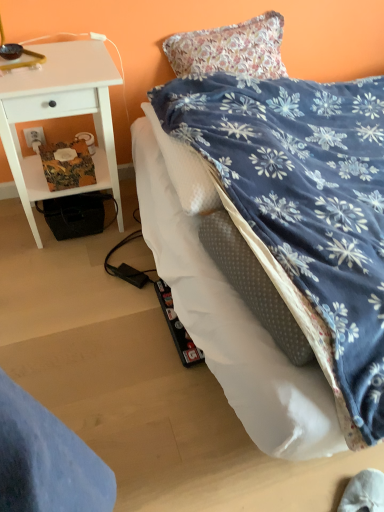
Question: Is white wood desk at left far away from white plastic power outlet at lower left?

Choices:
 (A) no
 (B) yes

Answer: (A)

Question: From a real-world perspective, does white wood desk at left stand above white plastic power outlet at lower left?

Choices:
 (A) no
 (B) yes

Answer: (B)

Question: Does white wood desk at left turn towards white plastic power outlet at lower left?

Choices:
 (A) yes
 (B) no

Answer: (B)

Question: From a real-world perspective, is white wood desk at left located beneath white plastic power outlet at lower left?

Choices:
 (A) yes
 (B) no

Answer: (B)

Question: Is white wood desk at left smaller than white plastic power outlet at lower left?

Choices:
 (A) no
 (B) yes

Answer: (A)

Question: Does white wood desk at left appear on the right side of white plastic power outlet at lower left?

Choices:
 (A) no
 (B) yes

Answer: (B)

Question: Does blue velvety bed at center have a larger size compared to white wood desk at left?

Choices:
 (A) no
 (B) yes

Answer: (B)

Question: From a real-world perspective, is blue velvety bed at center positioned under white wood desk at left based on gravity?

Choices:
 (A) yes
 (B) no

Answer: (A)

Question: Is blue velvety bed at center next to white wood desk at left?

Choices:
 (A) yes
 (B) no

Answer: (B)

Question: From the image's perspective, does blue velvety bed at center appear lower than white wood desk at left?

Choices:
 (A) no
 (B) yes

Answer: (B)

Question: Can we say blue velvety bed at center lies outside white wood desk at left?

Choices:
 (A) no
 (B) yes

Answer: (B)

Question: Can you confirm if blue velvety bed at center is shorter than white wood desk at left?

Choices:
 (A) no
 (B) yes

Answer: (B)

Question: From a real-world perspective, is white plastic power outlet at lower left positioned over white wood desk at left based on gravity?

Choices:
 (A) no
 (B) yes

Answer: (A)